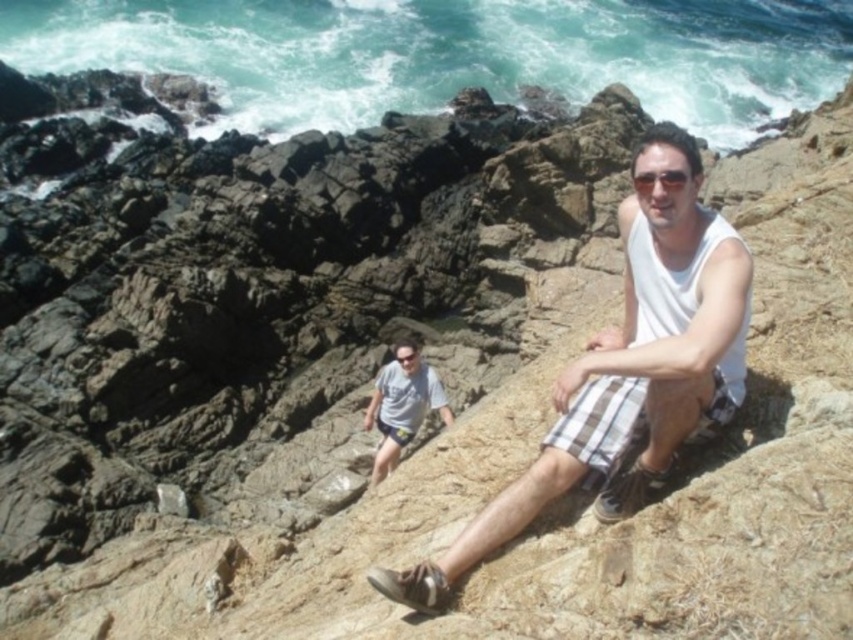
Question: Is white cotton tank top at center thinner than white cotton shirt at center?

Choices:
 (A) no
 (B) yes

Answer: (A)

Question: Which point is closer to the camera taking this photo?

Choices:
 (A) (378, 445)
 (B) (675, 209)

Answer: (B)

Question: Which of the following is the farthest from the observer?

Choices:
 (A) click(376, 452)
 (B) click(613, 380)

Answer: (A)

Question: Which object appears farthest from the camera in this image?

Choices:
 (A) white cotton shirt at center
 (B) white cotton tank top at center

Answer: (A)

Question: Considering the relative positions of white cotton tank top at center and white cotton shirt at center in the image provided, where is white cotton tank top at center located with respect to white cotton shirt at center?

Choices:
 (A) right
 (B) left

Answer: (A)

Question: Observing the image, what is the correct spatial positioning of white cotton tank top at center in reference to white cotton shirt at center?

Choices:
 (A) right
 (B) left

Answer: (A)